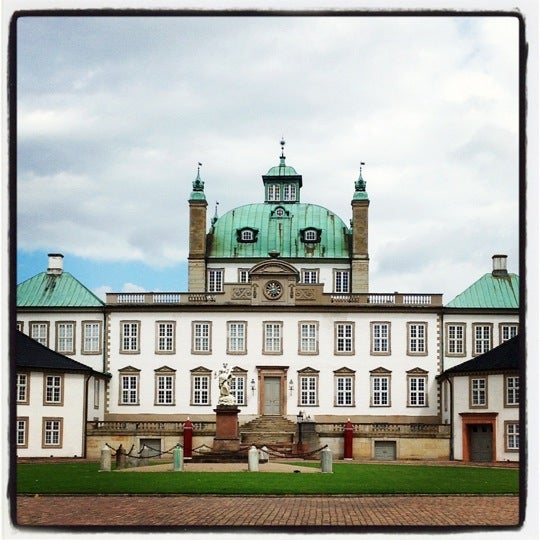
At what (x,y) coordinates should I click in order to perform the action: click on stairs. Please return your answer as a coordinate pair (x, y). The image size is (540, 540). Looking at the image, I should click on (269, 425).